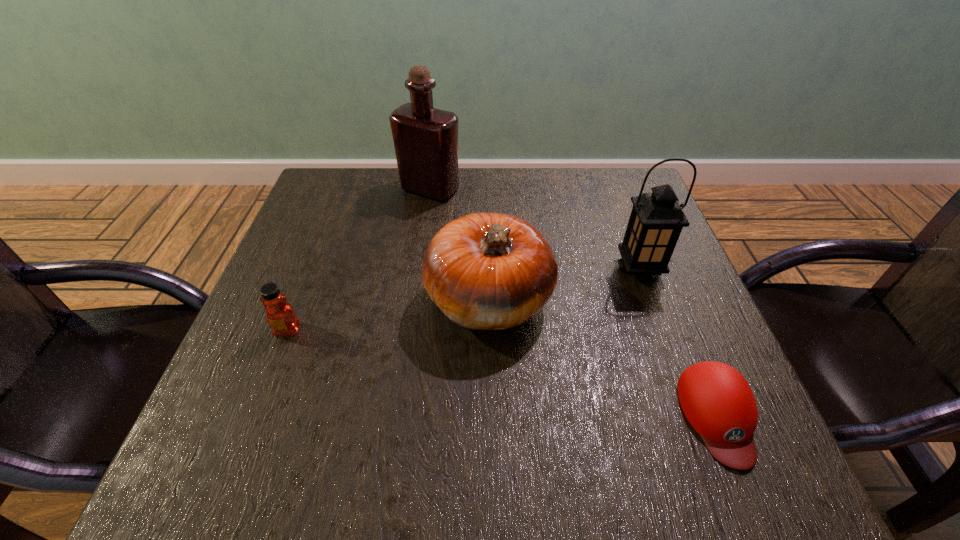
Where is `liquor`? liquor is located at coordinates coord(425,139).

Find the location of a particular element. This screenshot has height=540, width=960. lantern is located at coordinates (656, 220).

You are a GUI agent. You are given a task and a screenshot of the screen. Output one action in this format:
    pyautogui.click(x=<x>, y=<y>)
    Task: Click on the third shortest object
    This screenshot has width=960, height=540.
    Given the screenshot: What is the action you would take?
    pyautogui.click(x=485, y=271)

At what (x,y) coordinates should I click in order to perform the action: click on the leftmost object. Please return your answer as a coordinate pair (x, y). The height and width of the screenshot is (540, 960). Looking at the image, I should click on (280, 315).

Where is `honey`? honey is located at coordinates (280, 315).

Identify the location of the nearest object. The height and width of the screenshot is (540, 960). (716, 399).

This screenshot has height=540, width=960. What are the coordinates of `the shortest object` in the screenshot? It's located at (716, 399).

At what (x,y) coordinates should I click in order to perform the action: click on vacant space located 0.110m on the front of the liquor. Please return your answer as a coordinate pair (x, y). Looking at the image, I should click on click(424, 231).

The height and width of the screenshot is (540, 960). Find the location of `vacant space located on the back of the lantern`. vacant space located on the back of the lantern is located at coordinates (605, 176).

Identify the location of free location located on the back of the third shortest object. The height and width of the screenshot is (540, 960). (489, 235).